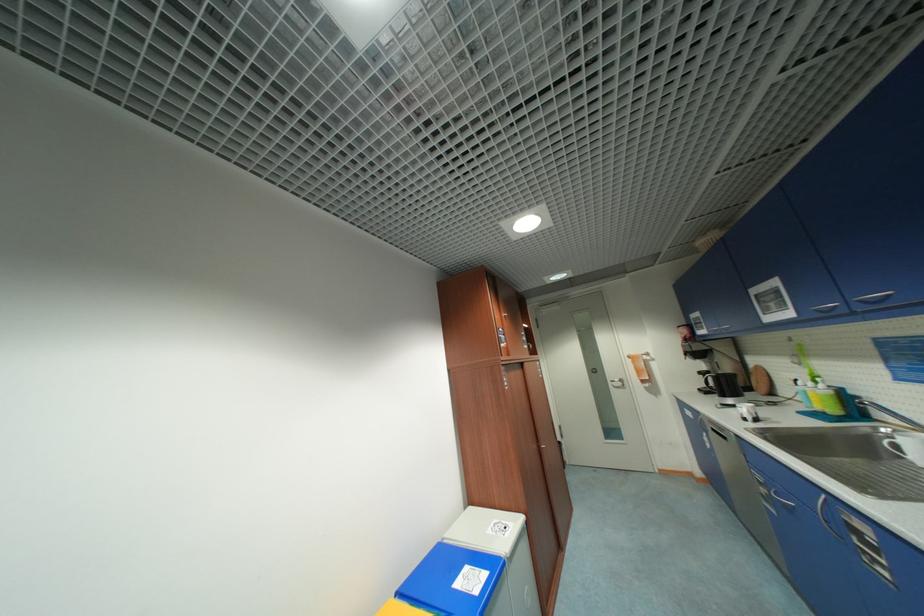
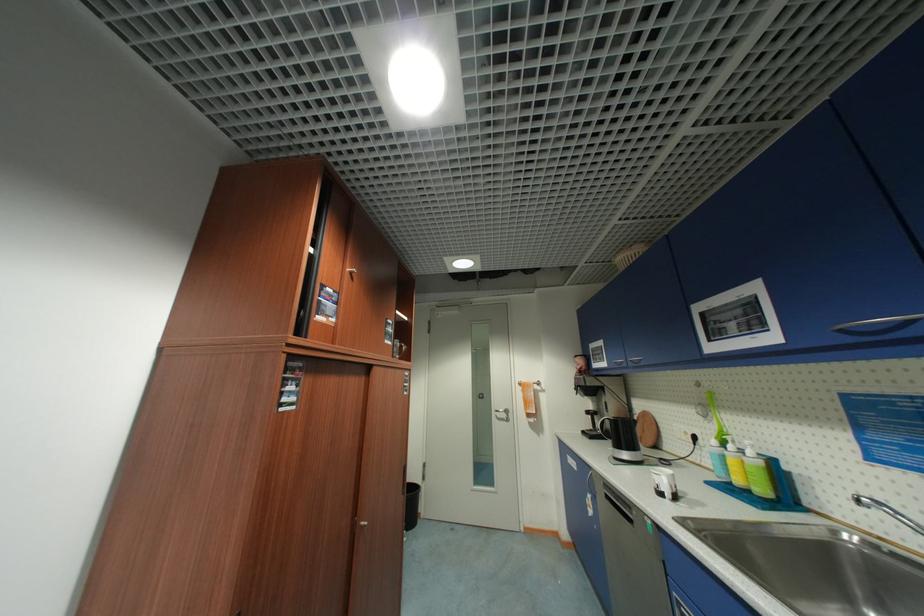
The point at (750, 419) is marked in the first image. Where is the corresponding point in the second image?

(666, 495)